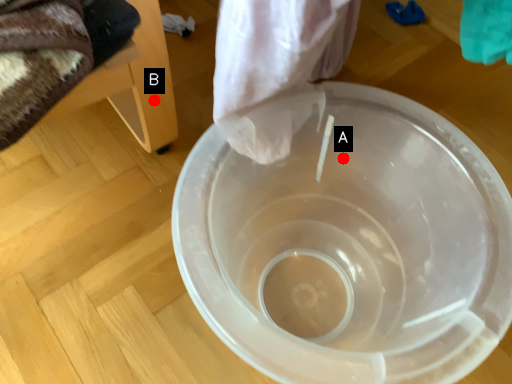
Question: Two points are circled on the image, labeled by A and B beside each circle. Among these points, which one is farthest from the camera?

Choices:
 (A) A is further
 (B) B is further

Answer: (A)